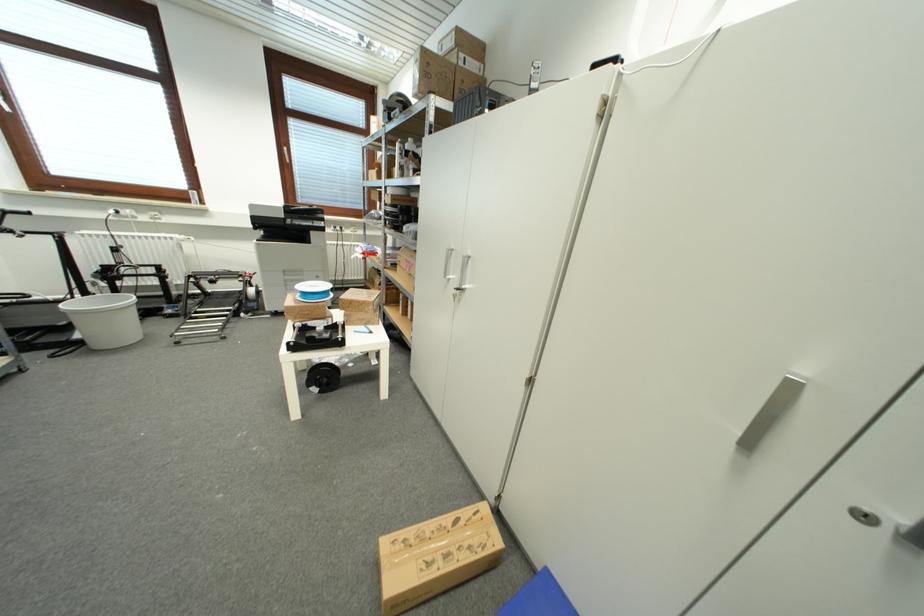
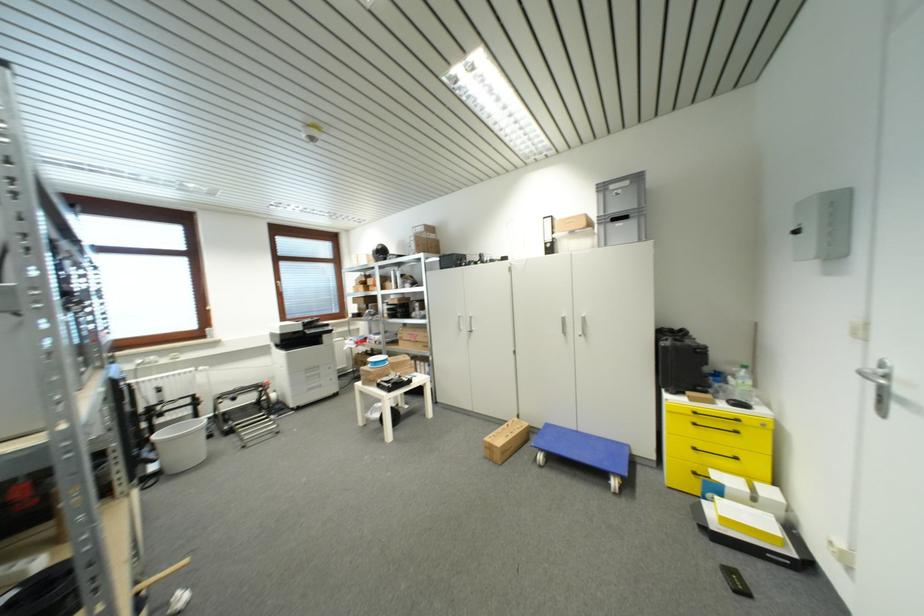
Locate, in the second image, the point that corresponds to (101,346) in the first image.

(177, 472)